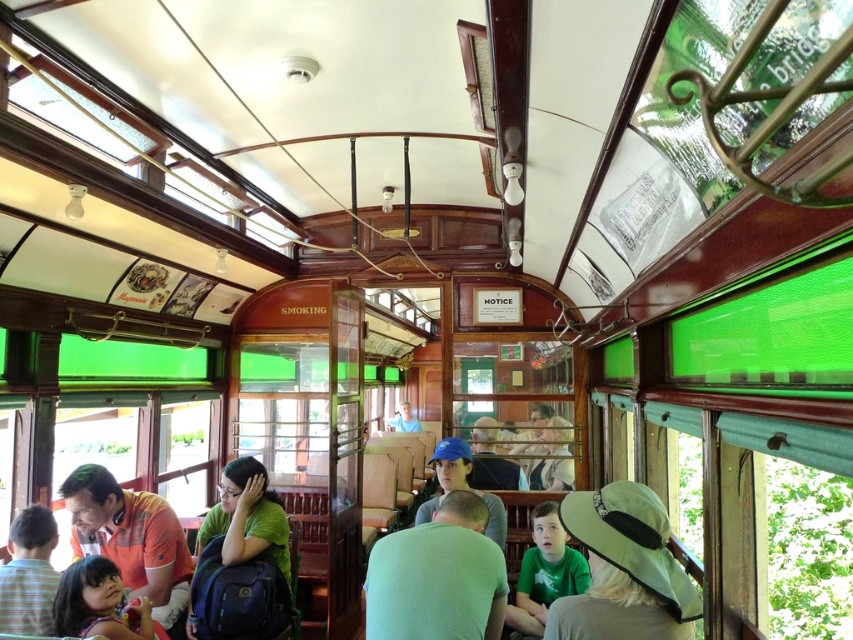
Can you confirm if striped shirt at lower left is wider than blue fabric cap at center?

Incorrect, striped shirt at lower left's width does not surpass blue fabric cap at center's.

Where is `striped shirt at lower left`? This screenshot has width=853, height=640. striped shirt at lower left is located at coordinates (28, 573).

The image size is (853, 640). Describe the element at coordinates (624, 570) in the screenshot. I see `green fabric hat at lower center` at that location.

Which is above, green fabric hat at lower center or green fabric backpack at center?

green fabric hat at lower center is above.

Is point (606, 563) less distant than point (270, 525)?

Yes, point (606, 563) is closer to viewer.

You are a GUI agent. You are given a task and a screenshot of the screen. Output one action in this format:
    pyautogui.click(x=<x>, y=<y>)
    Task: Click on the green fabric hat at lower center
    Image resolution: width=853 pixels, height=640 pixels.
    Given the screenshot: What is the action you would take?
    pyautogui.click(x=624, y=570)

Is green fabric hat at lower center further to the viewer compared to matte blue shirt at center?

That is False.

Is green fabric hat at lower center to the left of matte blue shirt at center from the viewer's perspective?

No, green fabric hat at lower center is not to the left of matte blue shirt at center.

Is point (579, 627) less distant than point (404, 426)?

Yes, it is.

You are a GUI agent. You are given a task and a screenshot of the screen. Output one action in this format:
    pyautogui.click(x=<x>, y=<y>)
    Task: Click on the green fabric hat at lower center
    
    Given the screenshot: What is the action you would take?
    pyautogui.click(x=624, y=570)